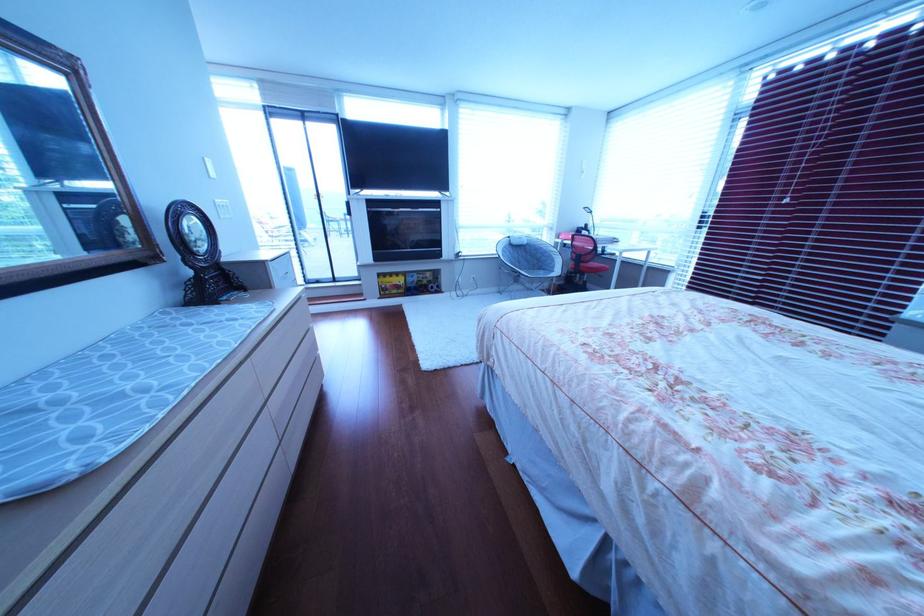
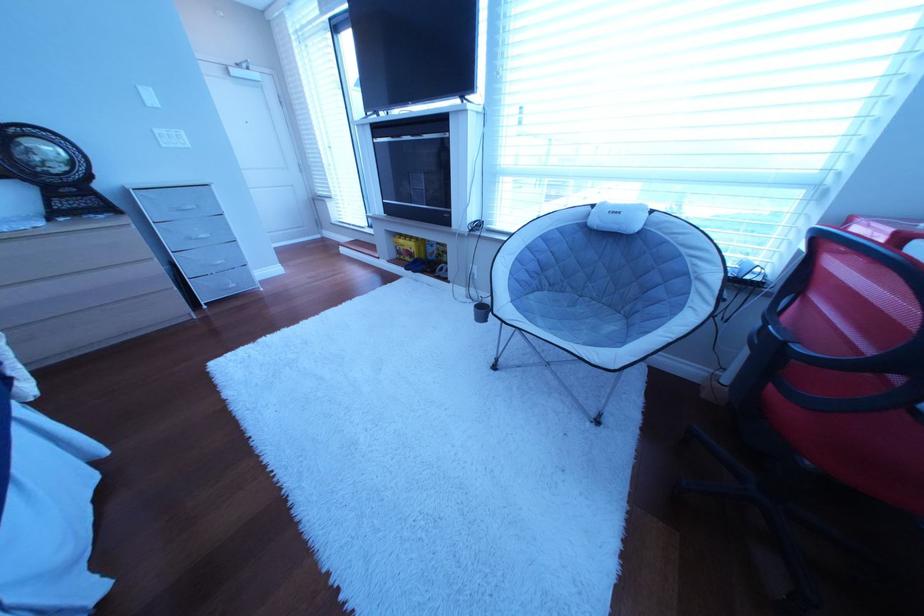
Where in the second image is the point corresponding to (237,217) from the first image?

(179, 148)